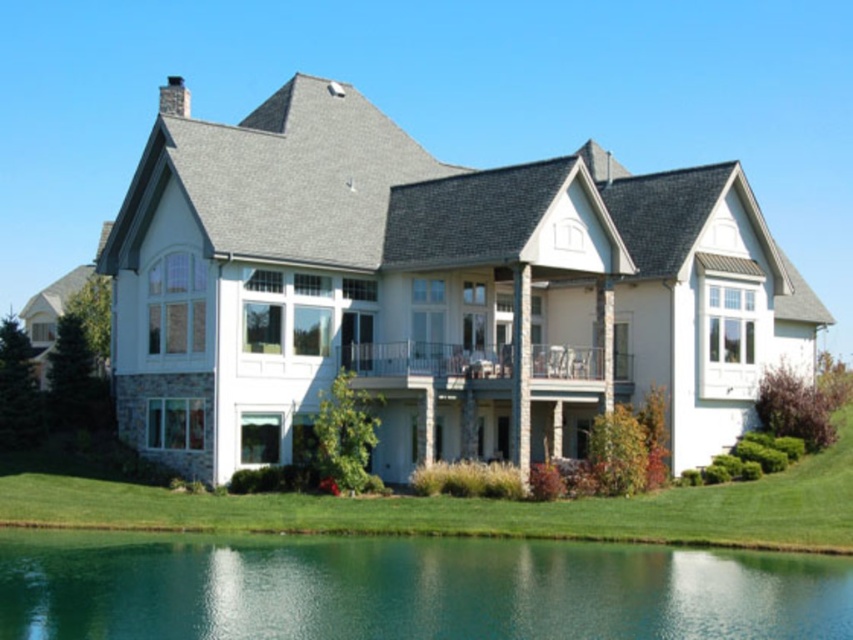
How far apart are green liquid water at lower center and green grass at lower center?

They are 6.78 meters apart.

Based on the photo, can you confirm if green liquid water at lower center is positioned to the right of green grass at lower center?

In fact, green liquid water at lower center is to the left of green grass at lower center.

Which is behind, point (154, 564) or point (567, 524)?

The point (567, 524) is more distant.

What are the coordinates of `green liquid water at lower center` in the screenshot? It's located at (407, 589).